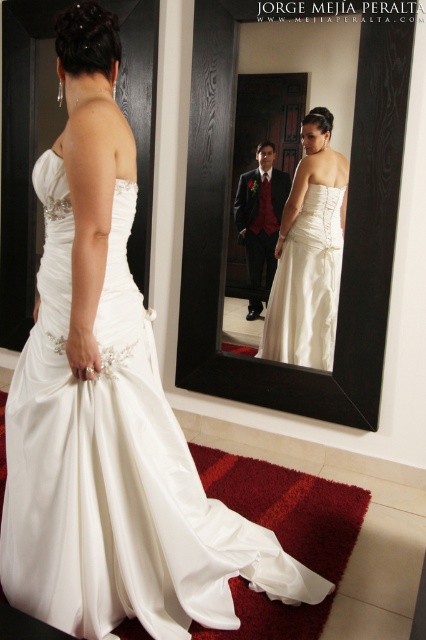
You are a photographer positioned at the center of the room. You want to capture a photo of the white satin dress at center. Based on its 2D coordinates, should you move left or right to frame the dress properly?

The white satin dress at center is located at point 0.733 on the x axis, which is to the right of the center. Therefore, you should move to the right to frame the dress properly.